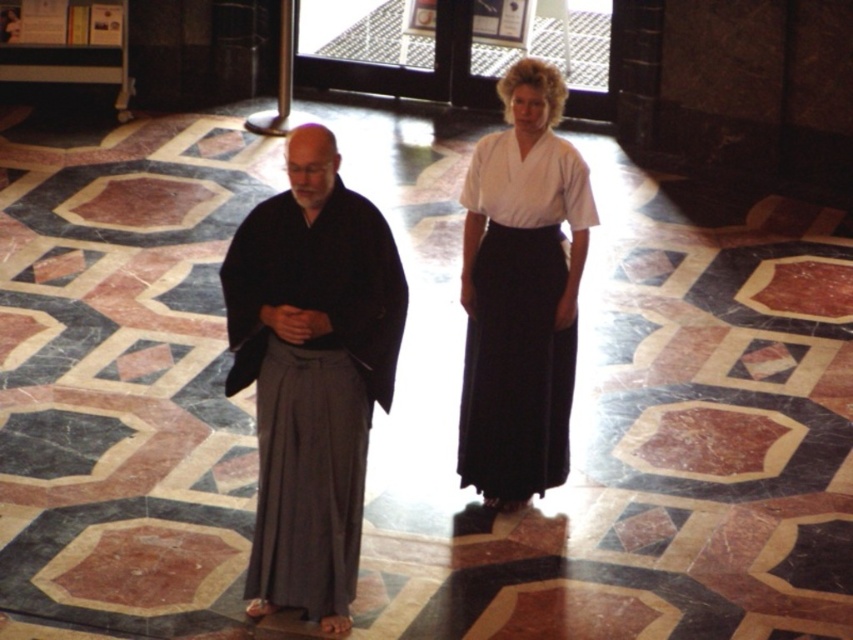
Who is more forward, (326, 168) or (473, 323)?

Point (326, 168) is more forward.

Does dark gray fabric kimono at center have a greater width compared to white cotton kimono at center?

Correct, the width of dark gray fabric kimono at center exceeds that of white cotton kimono at center.

Identify the location of dark gray fabric kimono at center. point(311,372).

Where is `dark gray fabric kimono at center`? dark gray fabric kimono at center is located at coordinates (311, 372).

Does black silk kimono at center have a greater height compared to white cotton kimono at center?

Indeed, black silk kimono at center has a greater height compared to white cotton kimono at center.

Is black silk kimono at center to the left of white cotton kimono at center from the viewer's perspective?

Yes, black silk kimono at center is to the left of white cotton kimono at center.

You are a GUI agent. You are given a task and a screenshot of the screen. Output one action in this format:
    pyautogui.click(x=<x>, y=<y>)
    Task: Click on the black silk kimono at center
    The image size is (853, 640).
    Given the screenshot: What is the action you would take?
    pyautogui.click(x=521, y=292)

Identify the location of black silk kimono at center. This screenshot has height=640, width=853. (521, 292).

Who is more distant from viewer, (287, 316) or (258, 308)?

Positioned behind is point (258, 308).

Does dark gray fabric kimono at center lie behind black silk kimono at center?

No, it is in front of black silk kimono at center.

Where is `dark gray fabric kimono at center`? dark gray fabric kimono at center is located at coordinates (311, 372).